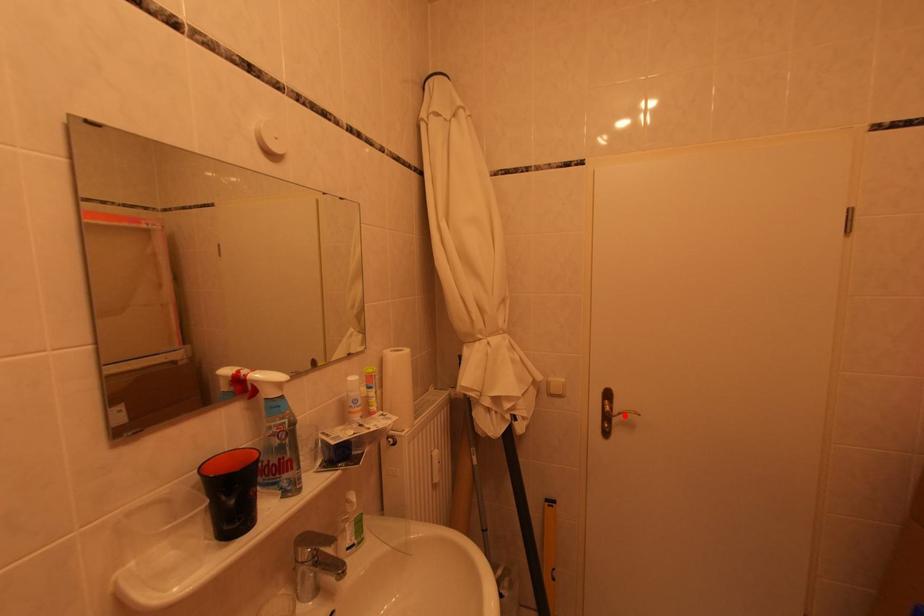
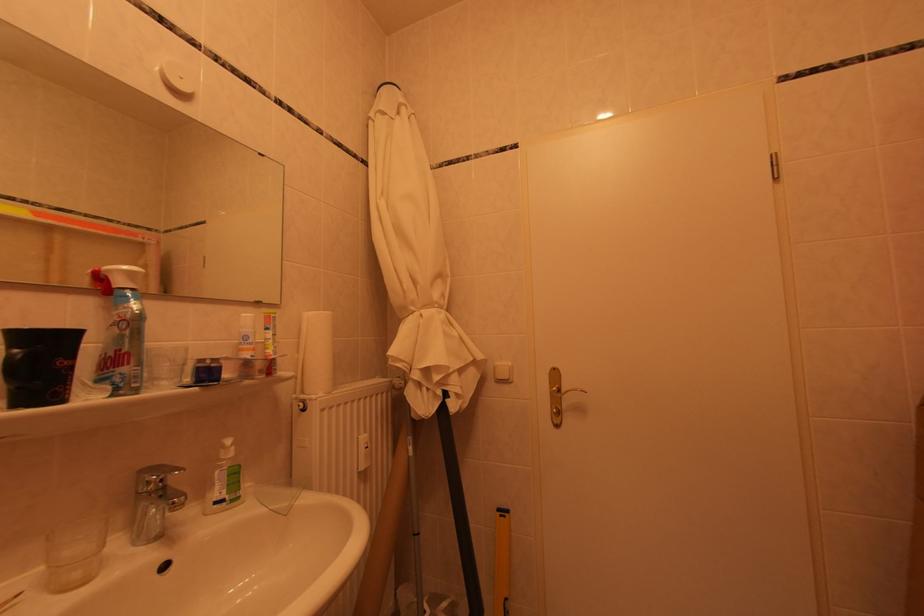
Where in the second image is the point corresponding to the highlighted location from the first image?

(572, 395)